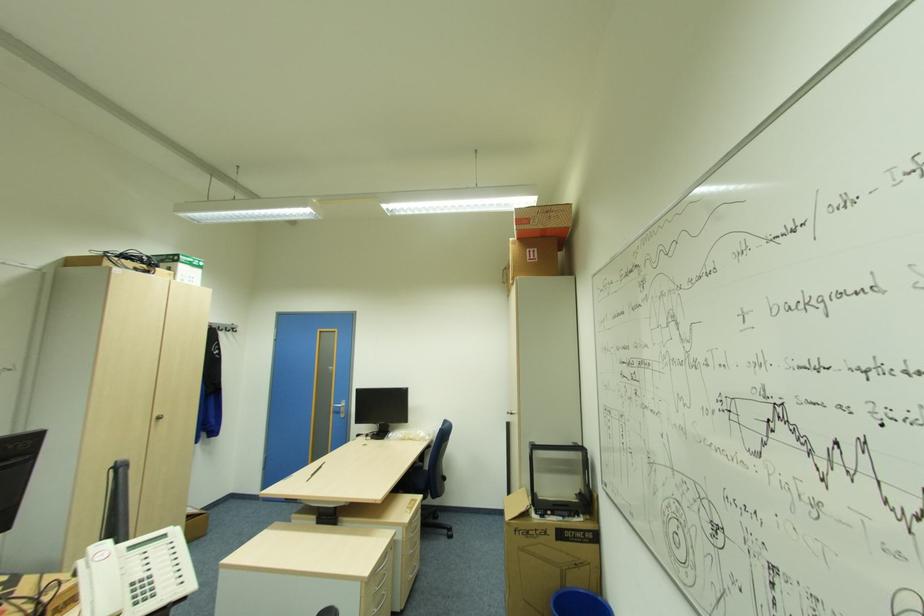
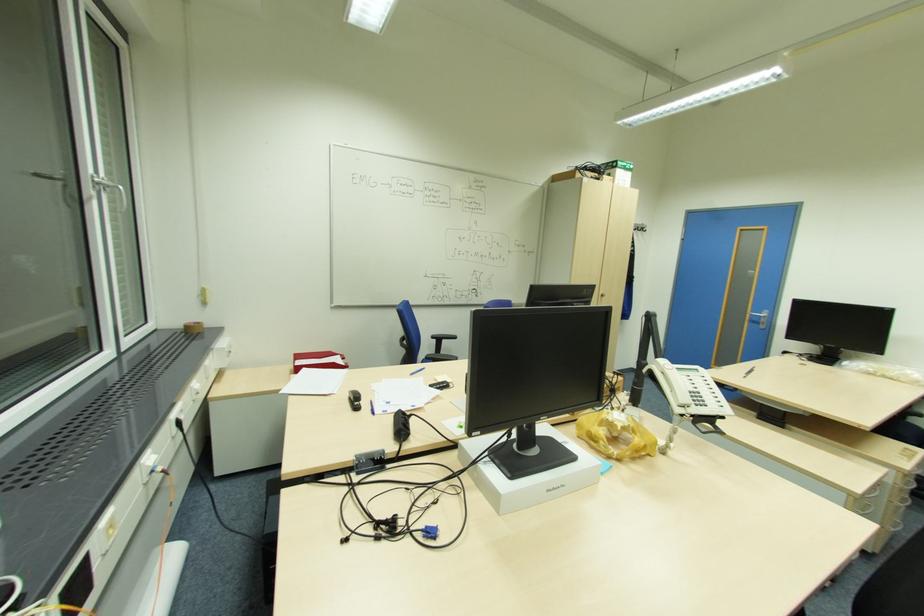
Question: The images are taken continuously from a first-person perspective. In which direction is your viewpoint rotating?

Choices:
 (A) Left
 (B) Right
 (C) Up
 (D) Down

Answer: (A)